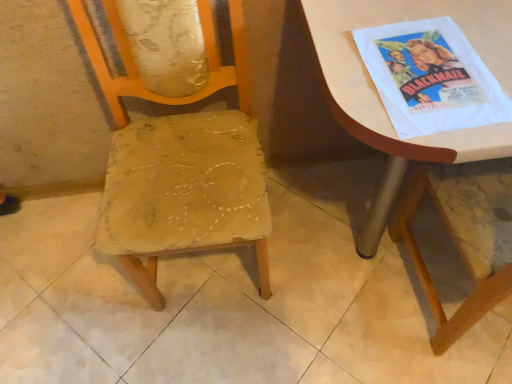
Question: Is white paper poster at upper right in front of or behind worn fabric chair at center in the image?

Choices:
 (A) front
 (B) behind

Answer: (B)

Question: From the image's perspective, is white paper poster at upper right positioned above or below worn fabric chair at center?

Choices:
 (A) below
 (B) above

Answer: (B)

Question: Which object is the closest to the white glossy table at upper right?

Choices:
 (A) worn fabric chair at center
 (B) white paper poster at upper right

Answer: (B)

Question: Estimate the real-world distances between objects in this image. Which object is farther from the white glossy table at upper right?

Choices:
 (A) white paper poster at upper right
 (B) worn fabric chair at center

Answer: (B)